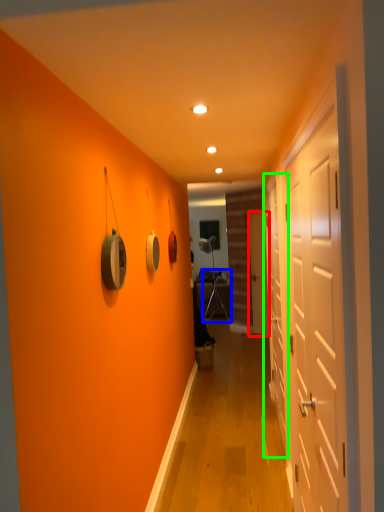
Question: Which object is the closest to the door (highlighted by a red box)? Choose among these: armchair (highlighted by a blue box) or door (highlighted by a green box).

Choices:
 (A) armchair
 (B) door

Answer: (A)